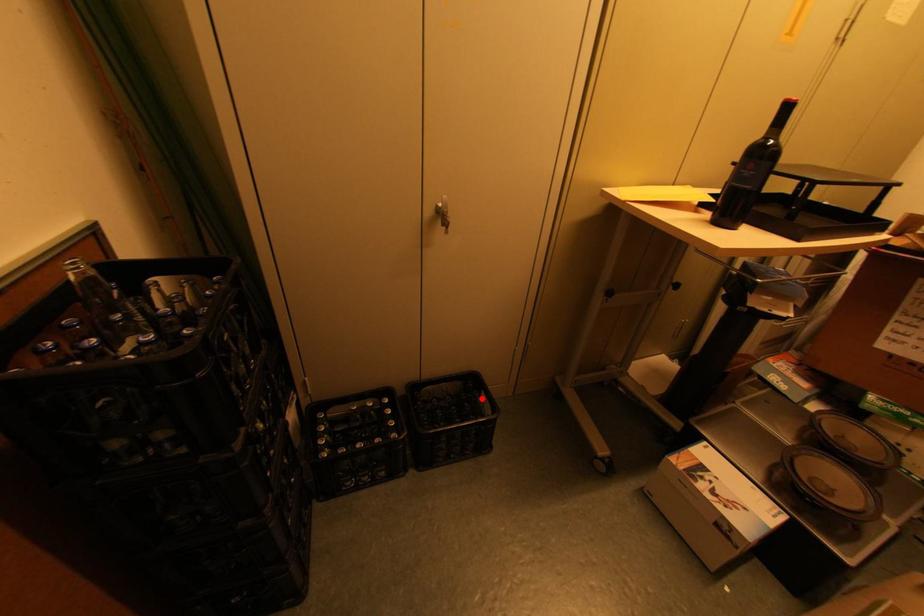
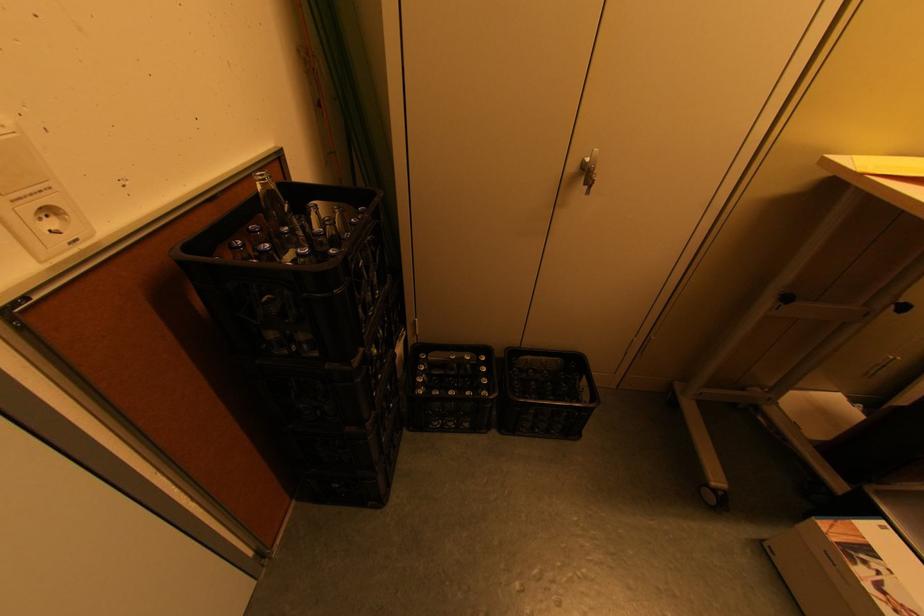
Where in the second image is the point corresponding to the highlighted location from the first image?

(581, 381)